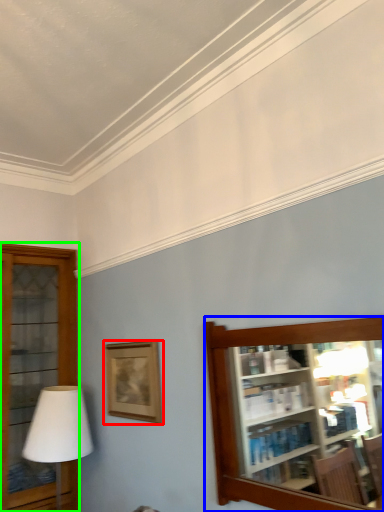
Question: Which object is the closest to the picture frame (highlighted by a red box)? Choose among these: shelf (highlighted by a blue box) or shelf (highlighted by a green box).

Choices:
 (A) shelf
 (B) shelf

Answer: (A)